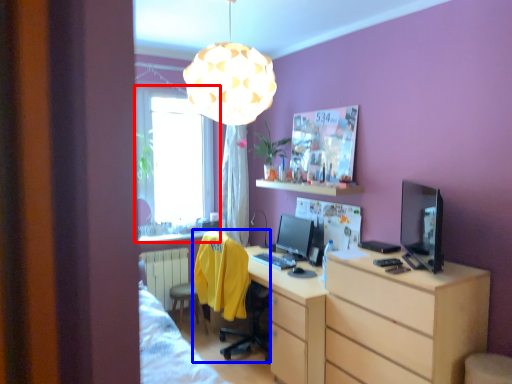
Question: Which of the following is the closest to the observer, window (highlighted by a red box) or swivel chair (highlighted by a blue box)?

Choices:
 (A) window
 (B) swivel chair

Answer: (B)